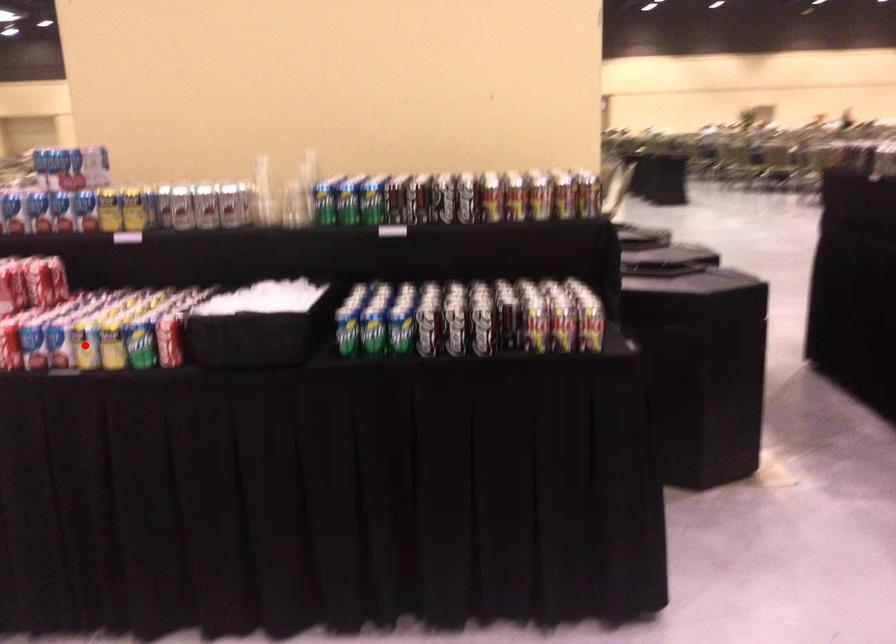
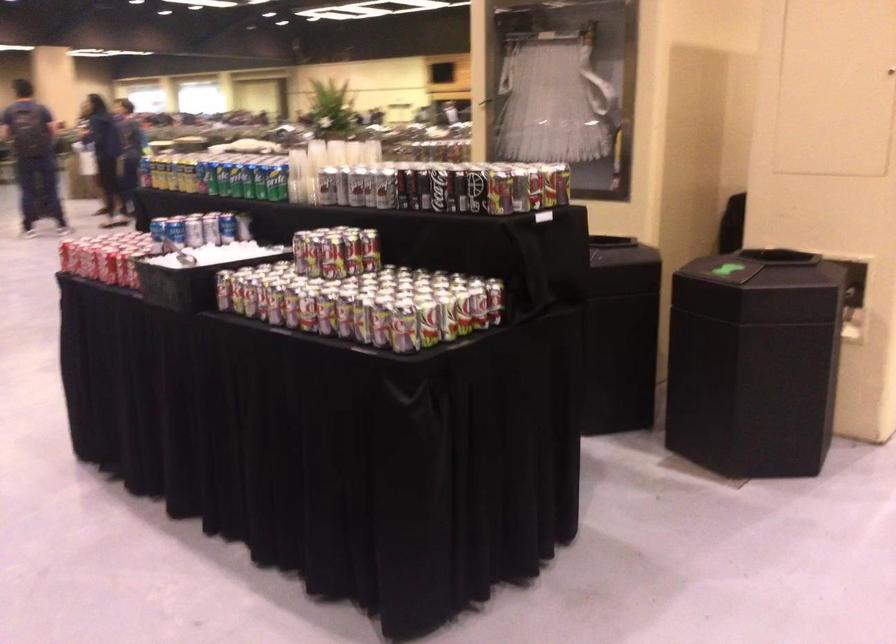
Question: I am providing you with two images of the same scene from different viewpoints. A red point is marked on the first image. At the location where the point appears in image 1, is it still visible in image 2?

Choices:
 (A) Yes
 (B) No

Answer: (B)